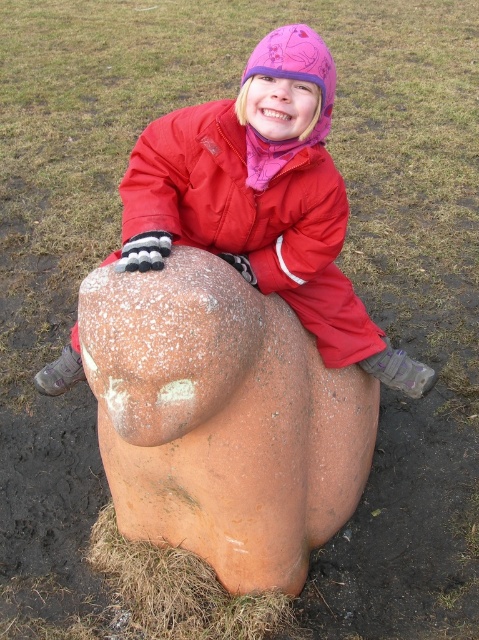
Question: Which is farther from the rusty stone bear at center?

Choices:
 (A) matte red snowsuit at center
 (B) red matte jacket at center

Answer: (B)

Question: Which of the following is the farthest from the observer?

Choices:
 (A) red matte jacket at center
 (B) matte red snowsuit at center
 (C) rusty stone bear at center

Answer: (A)

Question: Does rusty stone bear at center have a larger size compared to matte red snowsuit at center?

Choices:
 (A) yes
 (B) no

Answer: (A)

Question: Does rusty stone bear at center appear on the left side of matte red snowsuit at center?

Choices:
 (A) no
 (B) yes

Answer: (B)

Question: Can you confirm if rusty stone bear at center is wider than red matte jacket at center?

Choices:
 (A) no
 (B) yes

Answer: (B)

Question: Which of the following is the closest to the observer?

Choices:
 (A) rusty stone bear at center
 (B) matte red snowsuit at center
 (C) red matte jacket at center

Answer: (A)